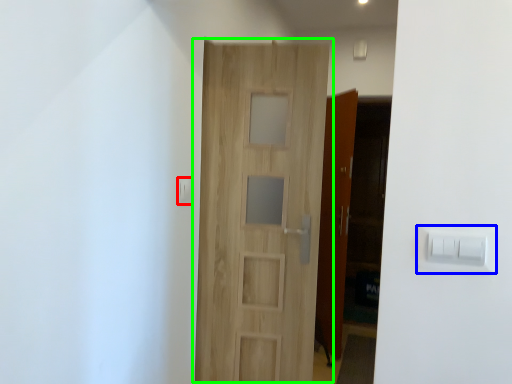
Question: Which object is the farthest from light switch (highlighted by a red box)? Choose among these: light switch (highlighted by a blue box) or door (highlighted by a green box).

Choices:
 (A) light switch
 (B) door

Answer: (A)